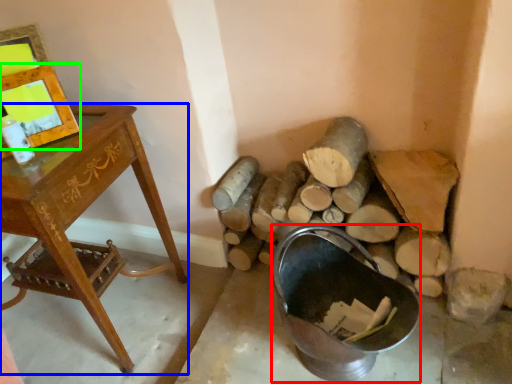
Question: Considering the real-world distances, which object is closest to basin (highlighted by a red box)? desk (highlighted by a blue box) or picture frame (highlighted by a green box).

Choices:
 (A) desk
 (B) picture frame

Answer: (A)